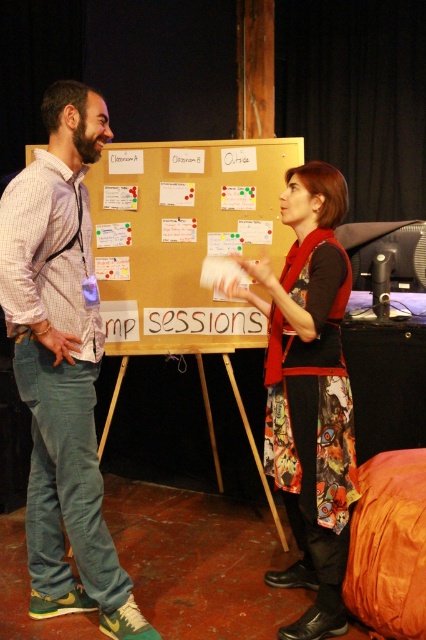
You are a photographer setting up for a group photo. You need to position the matte plaid shirt at left and the gold matte bulletin board at center so that both are visible in the frame. Given their height difference, which object will require you to adjust your camera angle upwards to capture properly?

The matte plaid shirt at left is much taller than the gold matte bulletin board at center, so you will need to adjust your camera angle upwards to capture the matte plaid shirt at left properly.

You are a photographer standing 10 feet away from the matte plaid shirt at left and the printed fabric dress at center. You want to take a photo of both objects in the same frame. Will you be able to capture both in the shot without moving the camera?

The matte plaid shirt at left is 28.41 inches from the printed fabric dress at center. At 10 feet away, the distance between them is within the typical field of view of a standard camera lens, so yes, both objects can be captured in the same frame without moving the camera.

You are an interior designer who needs to hang a new painting in this room. The painting is 1.2 meters wide. The gold matte bulletin board at center and the printed fabric dress at center are in the way. Which object must you move first to make space?

The printed fabric dress at center is behind the gold matte bulletin board at center, so you must move the gold matte bulletin board at center first to access the printed fabric dress at center.